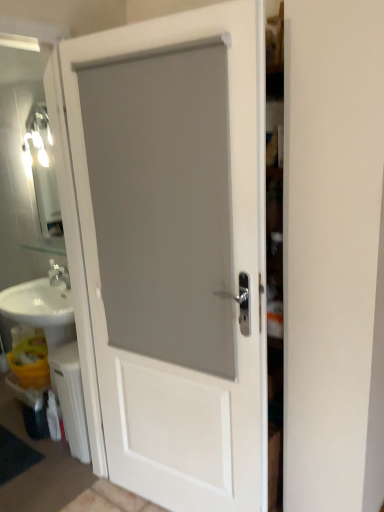
Question: Is white plastic radiator at lower left bigger or smaller than white matte door at center?

Choices:
 (A) small
 (B) big

Answer: (A)

Question: From their relative heights in the image, would you say white plastic radiator at lower left is taller or shorter than white matte door at center?

Choices:
 (A) short
 (B) tall

Answer: (A)

Question: From a real-world perspective, is white plastic radiator at lower left positioned above or below white matte door at center?

Choices:
 (A) above
 (B) below

Answer: (B)

Question: Is white matte door at center in front of or behind white plastic radiator at lower left in the image?

Choices:
 (A) behind
 (B) front

Answer: (B)

Question: Is white matte door at center bigger or smaller than white plastic radiator at lower left?

Choices:
 (A) big
 (B) small

Answer: (A)

Question: From the image's perspective, relative to white plastic radiator at lower left, is white matte door at center above or below?

Choices:
 (A) below
 (B) above

Answer: (B)

Question: Would you say white matte door at center is to the left or to the right of white plastic radiator at lower left in the picture?

Choices:
 (A) left
 (B) right

Answer: (B)